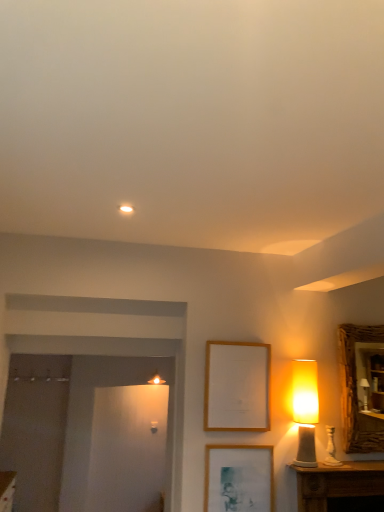
Question: Is point 241,410 positioned closer to the camera than point 362,445?

Choices:
 (A) farther
 (B) closer

Answer: (B)

Question: In the image, is wooden picture frame at center, which appears as the second picture frame when ordered from the bottom, positioned in front of or behind wooden textured mirror at right?

Choices:
 (A) front
 (B) behind

Answer: (A)

Question: Estimate the real-world distances between objects in this image. Which object is farther from the wooden textured mirror at right?

Choices:
 (A) wooden picture frame at lower center, the 1th picture frame ordered from the bottom
 (B) matte yellow lampshade at right
 (C) wooden picture frame at center, which appears as the second picture frame when ordered from the bottom

Answer: (A)

Question: Which is farther from the wooden picture frame at center, which is counted as the 1th picture frame, starting from the top?

Choices:
 (A) matte yellow lampshade at right
 (B) wooden picture frame at lower center, the 1th picture frame ordered from the bottom
 (C) wooden textured mirror at right

Answer: (C)